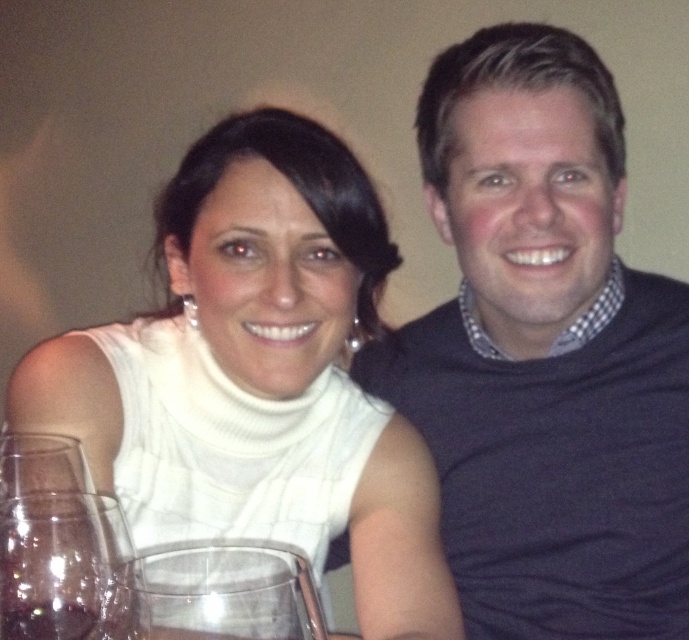
Does dark gray sweater at upper right appear over transparent glass at lower left?

Yes.

Is dark gray sweater at upper right to the left of transparent glass at lower left from the viewer's perspective?

Incorrect, dark gray sweater at upper right is not on the left side of transparent glass at lower left.

This screenshot has width=689, height=640. What do you see at coordinates (544, 353) in the screenshot?
I see `dark gray sweater at upper right` at bounding box center [544, 353].

Where is `dark gray sweater at upper right`? dark gray sweater at upper right is located at coordinates (544, 353).

Does point (125, 380) come behind point (287, 563)?

That is True.

Is point (256, 234) farther from camera compared to point (296, 552)?

No, (256, 234) is in front of (296, 552).

Identify the location of white turtleneck sweater at center. (258, 374).

Between transparent glass wine glass at lower left and clear glass wine glass at lower left, which one appears on the right side from the viewer's perspective?

transparent glass wine glass at lower left is more to the right.

Is point (116, 579) positioned after point (81, 561)?

That is False.

Where is `transparent glass wine glass at lower left`? transparent glass wine glass at lower left is located at coordinates (214, 593).